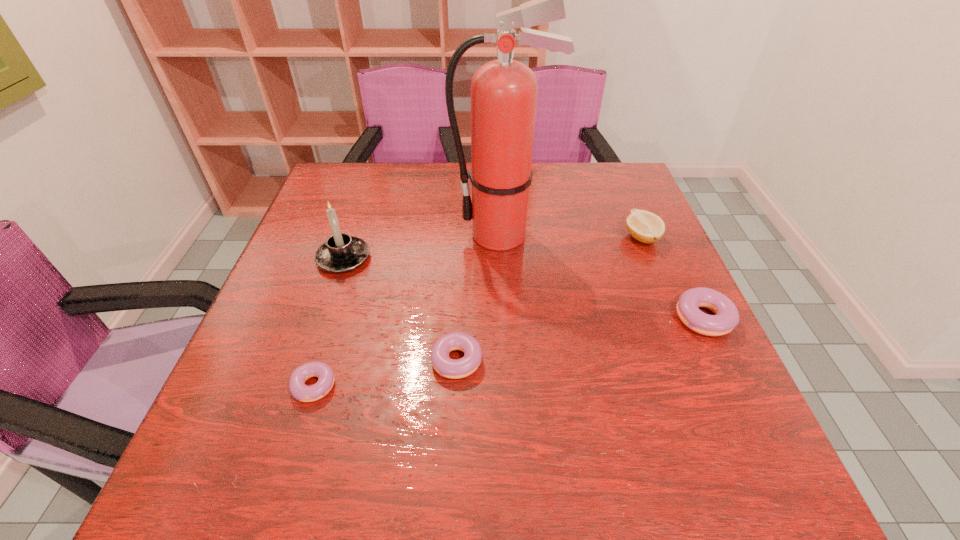
The image size is (960, 540). Find the location of `free space located 0.060m on the left of the fifth tallest object`. free space located 0.060m on the left of the fifth tallest object is located at coordinates (395, 361).

The width and height of the screenshot is (960, 540). What are the coordinates of `free space located on the back of the fourth tallest object` in the screenshot? It's located at (658, 233).

In order to click on free space located 0.170m on the hose direction of the fire extinguisher in this screenshot , I will do `click(387, 234)`.

The image size is (960, 540). Find the location of `vacant space located 0.120m on the hose direction of the fire extinguisher`. vacant space located 0.120m on the hose direction of the fire extinguisher is located at coordinates (406, 234).

Locate an element on the screen. free space located on the hose direction of the fire extinguisher is located at coordinates (313, 234).

Locate an element on the screen. The image size is (960, 540). free space located 0.140m with a handle on the side of the fifth shortest object is located at coordinates (428, 258).

Locate an element on the screen. The image size is (960, 540). vacant area located 0.200m on the left of the lemon is located at coordinates (545, 238).

Find the location of a particular element. object at the near edge is located at coordinates (300, 391).

The image size is (960, 540). What are the coordinates of `doughnut that is at the left edge` in the screenshot? It's located at coord(300,391).

Where is `candle holder that is at the left edge`? candle holder that is at the left edge is located at coordinates (341, 253).